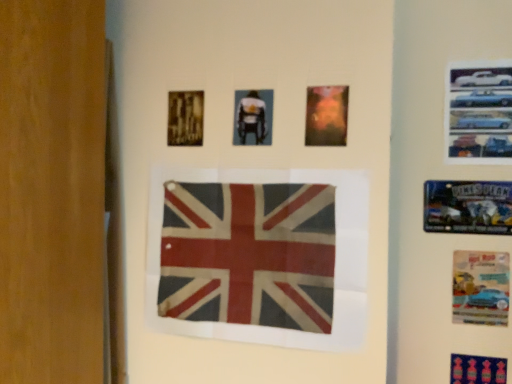
Question: Relative to metallic blue poster at upper right, the 3th poster when ordered from bottom to top, is matte orange poster at upper center, which is counted as the fourth poster, starting from the bottom, in front or behind?

Choices:
 (A) behind
 (B) front

Answer: (B)

Question: Looking at their shapes, would you say matte orange poster at upper center, arranged as the fifth poster when viewed from the right, is wider or thinner than metallic blue poster at upper right, the sixth poster from the left?

Choices:
 (A) thin
 (B) wide

Answer: (B)

Question: Estimate the real-world distances between objects in this image. Which object is farther from the blue fabric poster at lower right, which is counted as the first poster, starting from the bottom?

Choices:
 (A) gold textured poster at upper left, which is counted as the 2th poster, starting from the top
 (B) matte orange poster at upper center, arranged as the fifth poster when viewed from the right
 (C) rusty fabric flag at center
 (D) metallic blue poster at upper right, which appears as the 2th poster when viewed from the right
 (E) matte paper poster at lower right, positioned as the fifth poster in left-to-right order

Answer: (A)

Question: Estimate the real-world distances between objects in this image. Which object is farther from the matte paper poster at lower right, which appears as the 2th poster when ordered from the bottom?

Choices:
 (A) gold textured poster at upper left, which is the first poster from left to right
 (B) metallic cars at upper right, marked as the first poster in a right-to-left arrangement
 (C) blue fabric poster at lower right, marked as the 7th poster in a top-to-bottom arrangement
 (D) matte plastic poster at center, marked as the second poster in a left-to-right arrangement
 (E) metallic blue poster at upper right, the sixth poster from the left

Answer: (A)